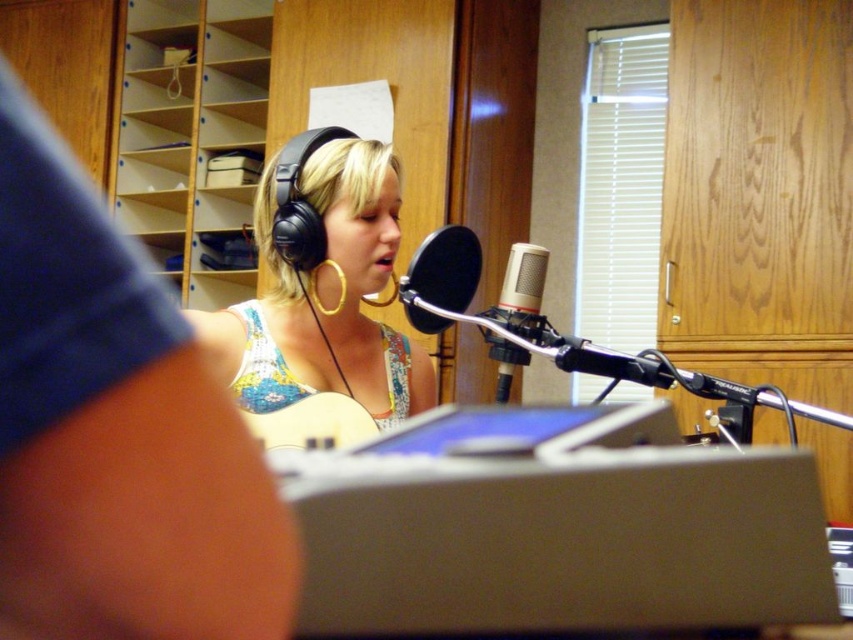
You are a sound engineer setting up a recording session. You need to place a monitor speaker exactly 0.3 meters to the right of the black matte microphone at center. Where should you place the monitor speaker in terms of coordinates?

The monitor speaker should be placed at coordinates approximately 0.436 plus 0.3 divided by the image width in meters. However, without knowing the image scale, we can state the relative coordinate as x increased by 0.3 meters from the black matte microphone at center. But since the question asks for coordinates based on the given point, the answer would be the original coordinates plus the offset in the x direction. Assuming the coordinate system is normalized where 1 unit equals the image width, adding 0.

You are a sound engineer setting up a recording session. The vocalist wants to stand closer to the microphone to avoid background noise. The vocalist is currently 3.92 feet away from the black matte microphone at center. Is the vocalist within the recommended 3 feet proximity for optimal vocal recording?

The vocalist is currently 3.92 feet away from the black matte microphone at center, which is slightly beyond the recommended 3 feet proximity for optimal vocal recording. To minimize background noise and ensure clear audio, the vocalist should move closer to the microphone.

You are setting up a recording studio and need to choose between the black matte microphone at center and the silver metallic microphone at center based on their sizes. Which microphone has a larger width?

The black matte microphone at center has a larger width than the silver metallic microphone at center according to the description.